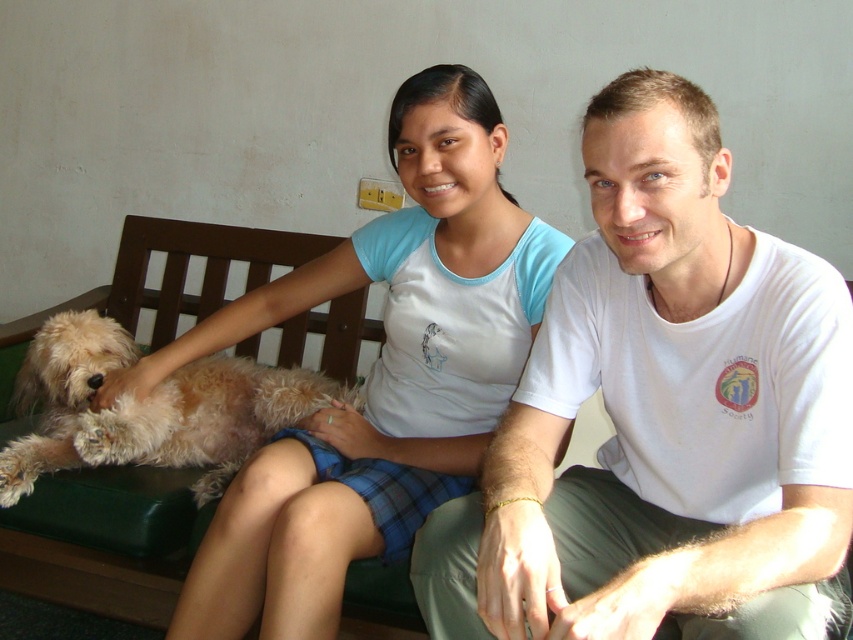
You are a photographer setting up a camera to capture the scene. The camera has a focus range that can only accommodate objects within a 1.2 meter width. Given the light blue fabric shirt at center and the fuzzy brown dog at lower left, will both fit within the focus range?

The light blue fabric shirt at center might be wider than the fuzzy brown dog at lower left, but since the focus range is 1.2 meters, both objects can fit within the focus range as long as their combined width does not exceed it. However, without exact measurements, it is uncertain if they will fit perfectly.

You are a photographer trying to capture a closeup of the light blue fabric shirt at center and the fuzzy brown dog at lower left. Since you want both subjects to be in focus, which one should you adjust the camera focus on first?

The light blue fabric shirt at center has a larger size compared to the fuzzy brown dog at lower left, so you should focus on the light blue fabric shirt at center first to ensure both are in focus.